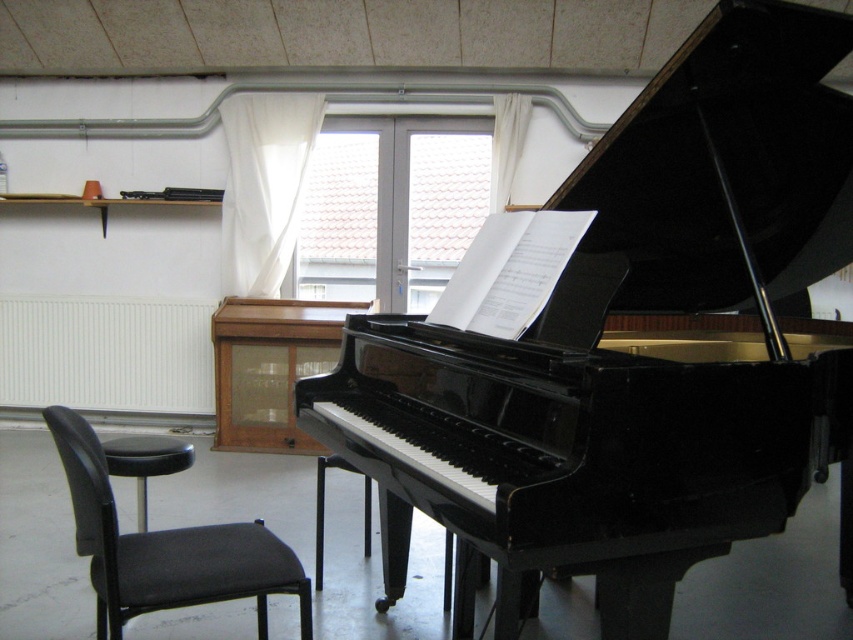
Question: Which of the following is the closest to the observer?

Choices:
 (A) (376, 252)
 (B) (819, 83)
 (C) (190, 448)

Answer: (B)

Question: Among these objects, which one is nearest to the camera?

Choices:
 (A) black leather stool at lower left
 (B) black fabric chair at lower left

Answer: (B)

Question: Estimate the real-world distances between objects in this image. Which object is farther from the glossy black piano at center?

Choices:
 (A) black leather stool at lower left
 (B) black fabric chair at lower left

Answer: (A)

Question: Can you confirm if black fabric chair at lower left is wider than black leather stool at lower left?

Choices:
 (A) no
 (B) yes

Answer: (B)

Question: Is white plastic window at center above black fabric chair at lower left?

Choices:
 (A) yes
 (B) no

Answer: (A)

Question: Is white plastic window at center closer to the viewer compared to black fabric chair at lower left?

Choices:
 (A) no
 (B) yes

Answer: (A)